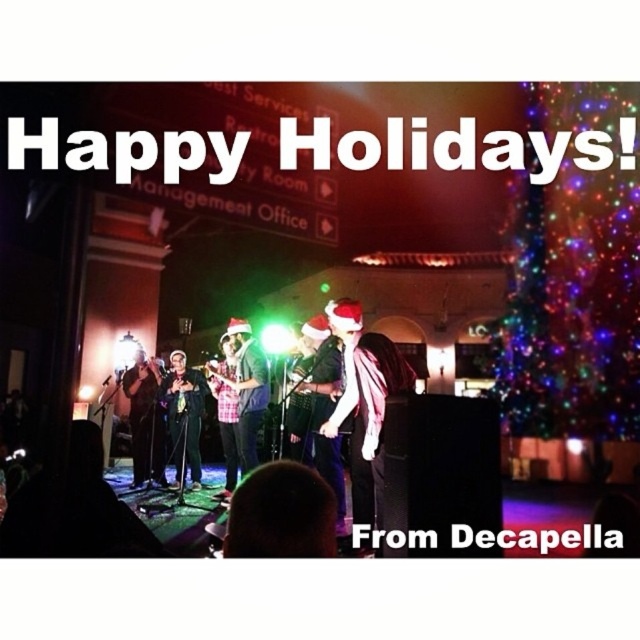
You are a photographer trying to capture a closeup of the plaid fabric shirt at center and the shiny black microphone at center. Which object should you zoom in on to ensure both are in frame without moving the camera?

The plaid fabric shirt at center is wider than the shiny black microphone at center, so you should zoom in on the plaid fabric shirt at center to accommodate its larger width while still capturing the microphone.

You are standing in the audience watching the festive holiday performance. You want to take a photo of the point at coordinate point (244, 355). Your camera has a focal length of 50mm and a sensor size of 24mm x 36mm. What is the minimum distance you need to be from the camera to capture the point in focus?

The point at coordinate point (244, 355) is 5.76 meters from the camera. To capture it in focus, you need to be at least 5.76 meters away from the camera.